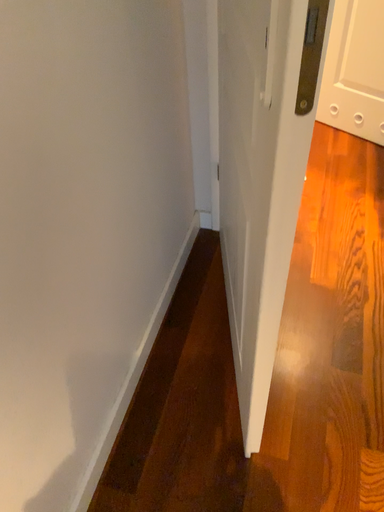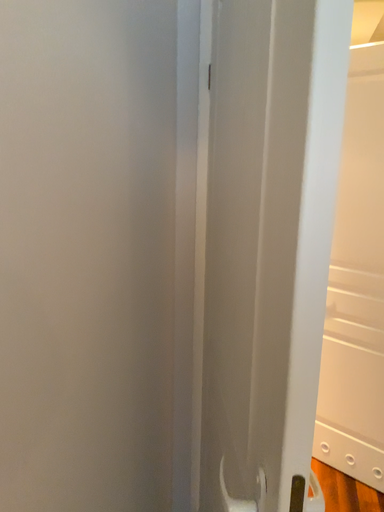
Question: How did the camera likely rotate when shooting the video?

Choices:
 (A) rotated upward
 (B) rotated downward

Answer: (A)